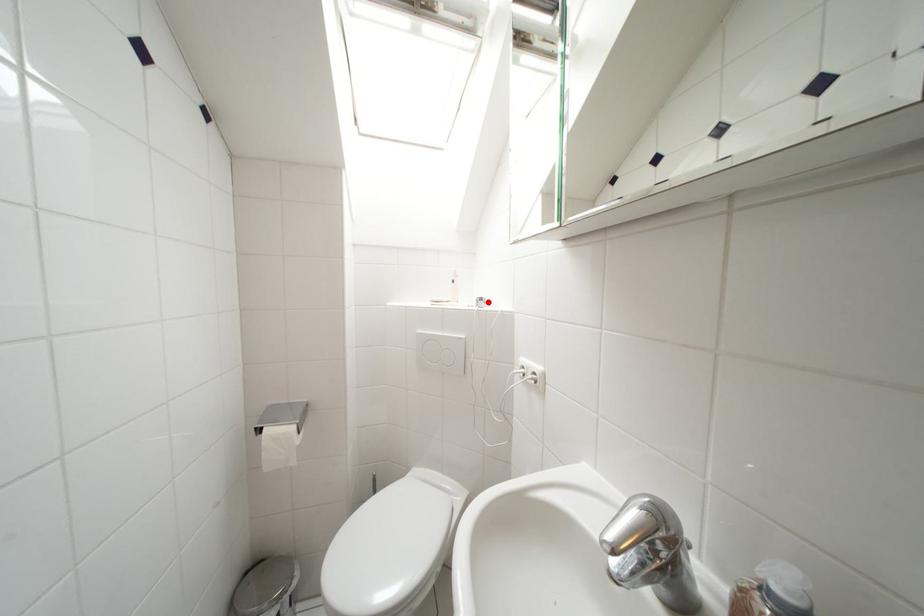
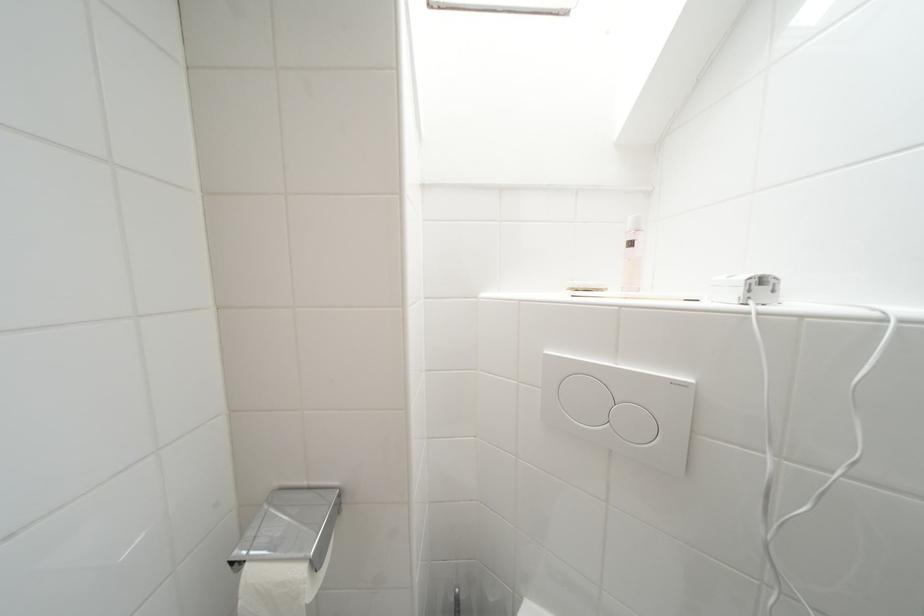
Find the pixel in the second image that matches the highlighted location in the first image.

(769, 283)